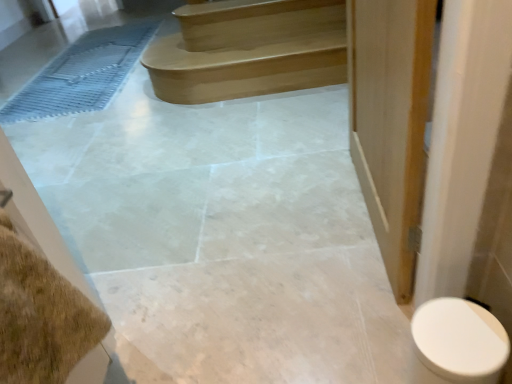
Question: From a real-world perspective, is white glossy toilet at lower right on top of blue rubber bath mat at left?

Choices:
 (A) yes
 (B) no

Answer: (A)

Question: Is the depth of white glossy toilet at lower right greater than that of blue rubber bath mat at left?

Choices:
 (A) no
 (B) yes

Answer: (A)

Question: Does white glossy toilet at lower right have a lesser height compared to blue rubber bath mat at left?

Choices:
 (A) yes
 (B) no

Answer: (B)

Question: Can you confirm if white glossy toilet at lower right is smaller than blue rubber bath mat at left?

Choices:
 (A) yes
 (B) no

Answer: (A)

Question: From the image's perspective, is white glossy toilet at lower right above blue rubber bath mat at left?

Choices:
 (A) no
 (B) yes

Answer: (A)

Question: From a real-world perspective, is white glossy toilet at lower right physically below blue rubber bath mat at left?

Choices:
 (A) no
 (B) yes

Answer: (A)

Question: Does white glossy toilet at lower right have a greater width compared to satin wood stairs at upper center?

Choices:
 (A) no
 (B) yes

Answer: (A)

Question: Can you confirm if white glossy toilet at lower right is smaller than satin wood stairs at upper center?

Choices:
 (A) yes
 (B) no

Answer: (A)

Question: From a real-world perspective, is white glossy toilet at lower right over satin wood stairs at upper center?

Choices:
 (A) no
 (B) yes

Answer: (A)

Question: Does white glossy toilet at lower right have a lesser height compared to satin wood stairs at upper center?

Choices:
 (A) no
 (B) yes

Answer: (A)

Question: From a real-world perspective, is white glossy toilet at lower right physically below satin wood stairs at upper center?

Choices:
 (A) no
 (B) yes

Answer: (B)

Question: Is white glossy toilet at lower right at the left side of satin wood stairs at upper center?

Choices:
 (A) yes
 (B) no

Answer: (B)

Question: From a real-world perspective, does satin wood stairs at upper center stand above white glossy toilet at lower right?

Choices:
 (A) yes
 (B) no

Answer: (A)